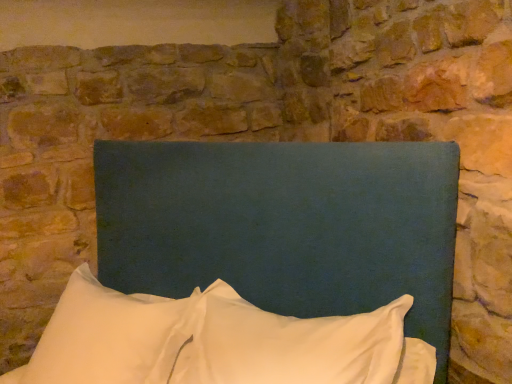
Question: Is white soft pillow at center, the 2th pillow when ordered from left to right, completely or partially outside of teal fabric headboard at center?

Choices:
 (A) no
 (B) yes

Answer: (A)

Question: Does white soft pillow at center, which is the first pillow from right to left, have a greater height compared to teal fabric headboard at center?

Choices:
 (A) no
 (B) yes

Answer: (A)

Question: Is white soft pillow at center, the 2th pillow when ordered from left to right, oriented towards teal fabric headboard at center?

Choices:
 (A) yes
 (B) no

Answer: (A)

Question: From a real-world perspective, is white soft pillow at center, the 2th pillow when ordered from left to right, under teal fabric headboard at center?

Choices:
 (A) no
 (B) yes

Answer: (B)

Question: Is teal fabric headboard at center located within white soft pillow at center, which is the first pillow from right to left?

Choices:
 (A) no
 (B) yes

Answer: (A)

Question: From their relative heights in the image, would you say white soft pillow at lower left, which is counted as the 2th pillow, starting from the right, is taller or shorter than white soft pillow at center, which is the first pillow from right to left?

Choices:
 (A) short
 (B) tall

Answer: (B)

Question: From a real-world perspective, is white soft pillow at lower left, which is counted as the 2th pillow, starting from the right, positioned above or below white soft pillow at center, the 2th pillow when ordered from left to right?

Choices:
 (A) above
 (B) below

Answer: (B)

Question: Is point (65, 327) positioned closer to the camera than point (216, 296)?

Choices:
 (A) closer
 (B) farther

Answer: (B)

Question: Considering their positions, is white soft pillow at lower left, which is counted as the 2th pillow, starting from the right, located in front of or behind white soft pillow at center, the 2th pillow when ordered from left to right?

Choices:
 (A) front
 (B) behind

Answer: (B)

Question: Is white soft pillow at lower left, which is counted as the 2th pillow, starting from the right, inside the boundaries of teal fabric headboard at center, or outside?

Choices:
 (A) inside
 (B) outside

Answer: (A)

Question: Looking at the image, does white soft pillow at lower left, arranged as the first pillow when viewed from the left, seem bigger or smaller compared to teal fabric headboard at center?

Choices:
 (A) big
 (B) small

Answer: (B)

Question: From a real-world perspective, relative to teal fabric headboard at center, is white soft pillow at lower left, arranged as the first pillow when viewed from the left, vertically above or below?

Choices:
 (A) below
 (B) above

Answer: (A)

Question: In terms of height, does white soft pillow at lower left, which is counted as the 2th pillow, starting from the right, look taller or shorter compared to teal fabric headboard at center?

Choices:
 (A) short
 (B) tall

Answer: (A)

Question: Would you say teal fabric headboard at center is to the left or to the right of white soft pillow at center, the 2th pillow when ordered from left to right, in the picture?

Choices:
 (A) left
 (B) right

Answer: (A)

Question: Considering their positions, is teal fabric headboard at center located in front of or behind white soft pillow at center, which is the first pillow from right to left?

Choices:
 (A) behind
 (B) front

Answer: (B)